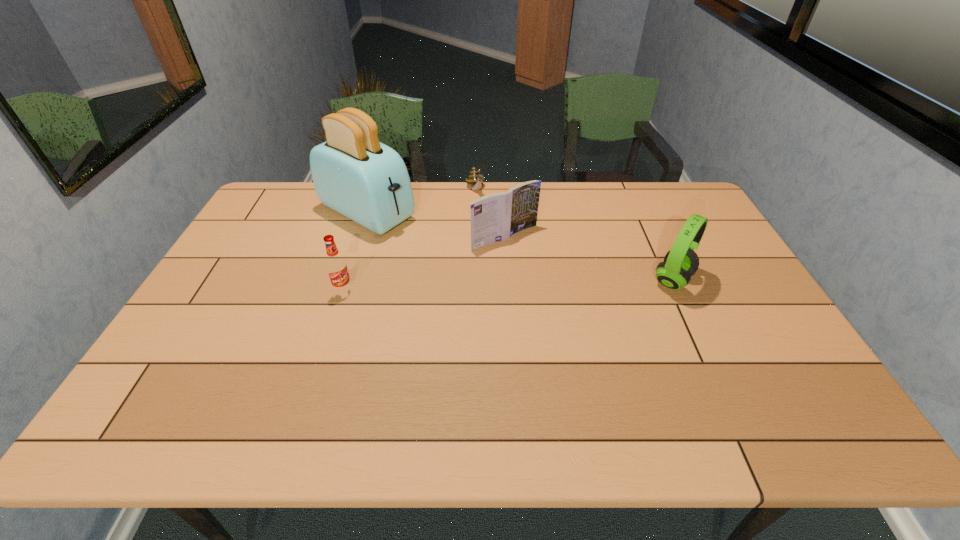
Find the location of a particular element. free spot between the rightmost object and the shortest object is located at coordinates (574, 235).

At what (x,y) coordinates should I click in order to perform the action: click on vacant area that lies between the toaster and the snail. Please return your answer as a coordinate pair (x, y). Looking at the image, I should click on (421, 201).

Identify the location of free space between the rightmost object and the toaster. The height and width of the screenshot is (540, 960). (520, 247).

Choose which object is the second nearest neighbor to the shortest object. Please provide its 2D coordinates. Your answer should be formatted as a tuple, i.e. [(x, y)], where the tuple contains the x and y coordinates of a point satisfying the conditions above.

[(353, 173)]

Select which object is the closest to the headset. Please provide its 2D coordinates. Your answer should be formatted as a tuple, i.e. [(x, y)], where the tuple contains the x and y coordinates of a point satisfying the conditions above.

[(495, 217)]

This screenshot has width=960, height=540. Identify the location of free spot that satisfies the following two spatial constraints: 1. on the front side of the tallest object; 2. on the left side of the headset. (346, 280).

Image resolution: width=960 pixels, height=540 pixels. In order to click on free space that satisfies the following two spatial constraints: 1. on the front side of the toaster; 2. on the left side of the root beer in this screenshot , I will do `click(343, 290)`.